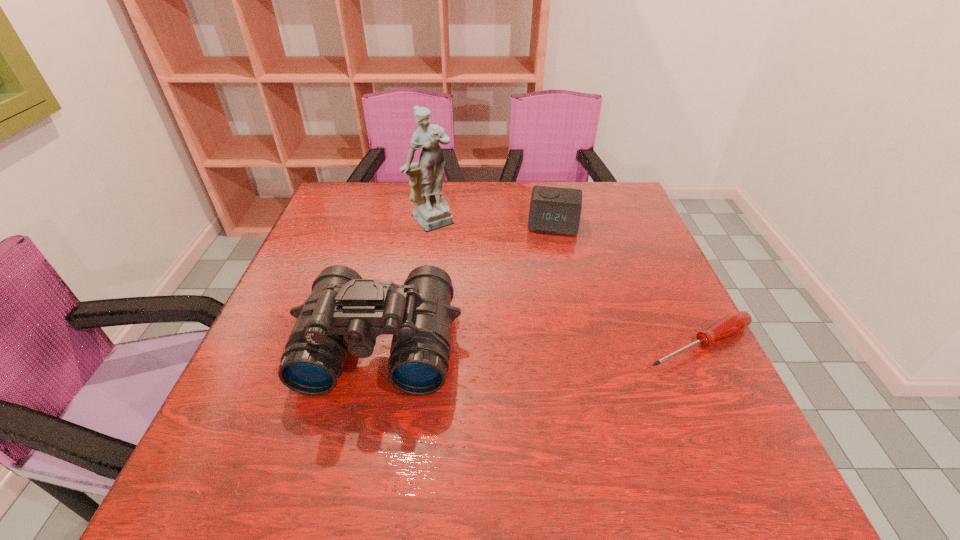
Where is `vacant position at the near edge of the desktop`? The image size is (960, 540). vacant position at the near edge of the desktop is located at coordinates coord(324,437).

Image resolution: width=960 pixels, height=540 pixels. I want to click on vacant space at the left edge of the desktop, so click(262, 340).

Where is `vacant space at the right edge`? vacant space at the right edge is located at coordinates (620, 230).

The width and height of the screenshot is (960, 540). Identify the location of blank space at the far left corner of the desktop. (361, 201).

You are a GUI agent. You are given a task and a screenshot of the screen. Output one action in this format:
    pyautogui.click(x=<x>, y=<y>)
    Task: Click on the free space at the near left corner
    The width and height of the screenshot is (960, 540).
    Given the screenshot: What is the action you would take?
    pyautogui.click(x=230, y=411)

This screenshot has width=960, height=540. Identify the location of vacant space at the far right corner of the desktop. (593, 184).

At what (x,y) coordinates should I click in order to perform the action: click on free space between the rightmost object and the alarm clock. Please return your answer as a coordinate pair (x, y). This screenshot has width=960, height=540. Looking at the image, I should click on (626, 284).

Image resolution: width=960 pixels, height=540 pixels. Identify the location of free space between the third object from left to right and the binoculars. (467, 284).

The image size is (960, 540). Find the location of `empty location between the screwdriver and the binoculars`. empty location between the screwdriver and the binoculars is located at coordinates (540, 344).

The height and width of the screenshot is (540, 960). What are the coordinates of `free space between the rightmost object and the binoculars` in the screenshot? It's located at (540, 344).